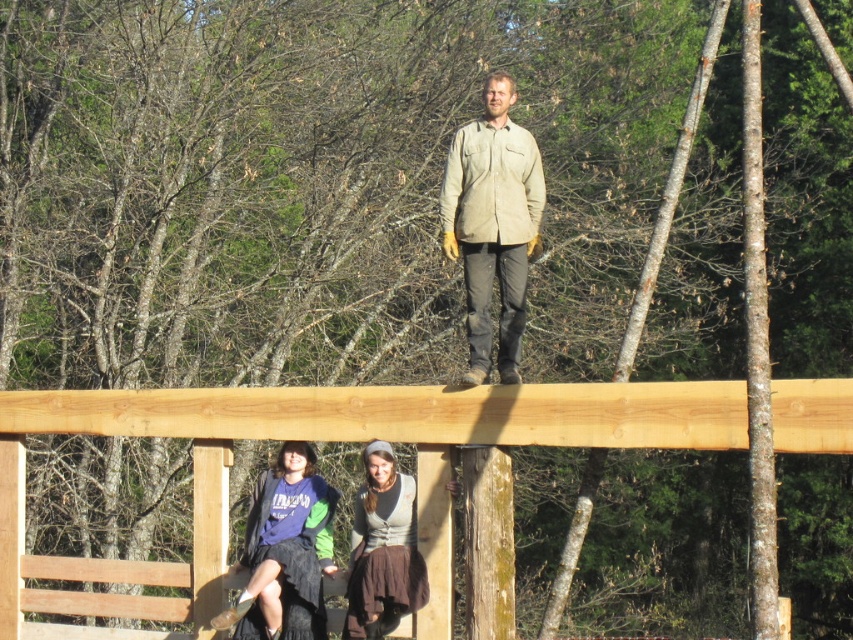
Is point (7, 513) closer to camera compared to point (262, 627)?

No, it is behind (262, 627).

Describe the element at coordinates (345, 440) in the screenshot. I see `natural wood beam at upper center` at that location.

Measure the distance between natural wood beam at upper center and camera.

natural wood beam at upper center is 13.57 meters away from camera.

Locate an element on the screen. This screenshot has height=640, width=853. natural wood beam at upper center is located at coordinates (345, 440).

The width and height of the screenshot is (853, 640). Describe the element at coordinates (345, 440) in the screenshot. I see `natural wood beam at upper center` at that location.

Is point (296, 438) positioned behind point (442, 188)?

Yes, it is.

What do you see at coordinates (345, 440) in the screenshot?
I see `natural wood beam at upper center` at bounding box center [345, 440].

I want to click on natural wood beam at upper center, so click(345, 440).

Based on the photo, which is above, natural wood beam at upper center or brown fabric skirt at lower center?

natural wood beam at upper center is higher up.

Does natural wood beam at upper center have a larger size compared to brown fabric skirt at lower center?

No.

Image resolution: width=853 pixels, height=640 pixels. What are the coordinates of `natural wood beam at upper center` in the screenshot? It's located at (345, 440).

I want to click on natural wood beam at upper center, so click(x=345, y=440).